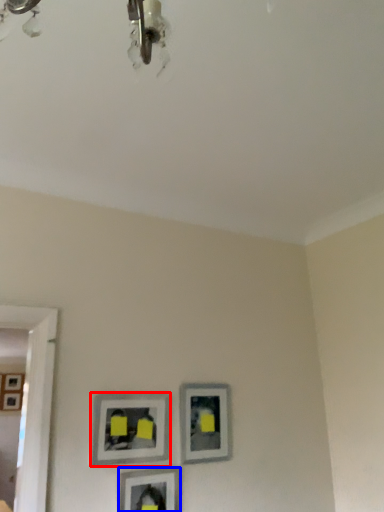
Question: Which point is closer to the camera, picture frame (highlighted by a red box) or picture frame (highlighted by a blue box)?

Choices:
 (A) picture frame
 (B) picture frame

Answer: (B)